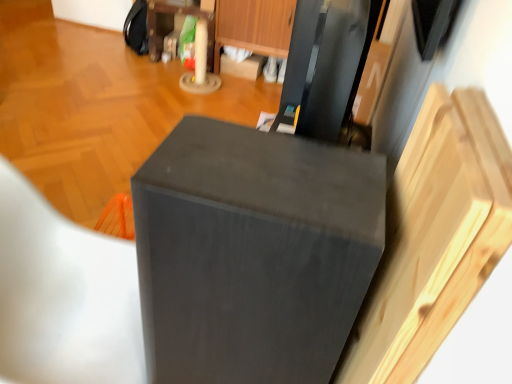
Question: Is matte wood dresser at upper center taller than matte black speaker at center?

Choices:
 (A) no
 (B) yes

Answer: (A)

Question: Is matte wood dresser at upper center behind matte black speaker at center?

Choices:
 (A) no
 (B) yes

Answer: (B)

Question: From the image's perspective, is matte wood dresser at upper center located beneath matte black speaker at center?

Choices:
 (A) yes
 (B) no

Answer: (B)

Question: Is matte wood dresser at upper center positioned before matte black speaker at center?

Choices:
 (A) yes
 (B) no

Answer: (B)

Question: Are matte wood dresser at upper center and matte black speaker at center far apart?

Choices:
 (A) no
 (B) yes

Answer: (B)

Question: Considering the relative positions of matte wood dresser at upper center and wooden drawer at upper center in the image provided, is matte wood dresser at upper center to the left or to the right of wooden drawer at upper center?

Choices:
 (A) left
 (B) right

Answer: (A)

Question: Looking at the image, does matte wood dresser at upper center seem bigger or smaller compared to wooden drawer at upper center?

Choices:
 (A) small
 (B) big

Answer: (A)

Question: In the image, is matte wood dresser at upper center positioned in front of or behind wooden drawer at upper center?

Choices:
 (A) behind
 (B) front

Answer: (A)

Question: From a real-world perspective, relative to wooden drawer at upper center, is matte wood dresser at upper center vertically above or below?

Choices:
 (A) below
 (B) above

Answer: (A)

Question: From the image's perspective, is matte wood dresser at upper center located above or below matte black folding chair at lower left?

Choices:
 (A) below
 (B) above

Answer: (B)

Question: Visually, is matte wood dresser at upper center positioned to the left or to the right of matte black folding chair at lower left?

Choices:
 (A) left
 (B) right

Answer: (A)

Question: Is matte wood dresser at upper center bigger or smaller than matte black folding chair at lower left?

Choices:
 (A) small
 (B) big

Answer: (A)

Question: Is matte wood dresser at upper center in front of or behind matte black folding chair at lower left in the image?

Choices:
 (A) behind
 (B) front

Answer: (A)

Question: Does point (25, 248) appear closer or farther from the camera than point (254, 33)?

Choices:
 (A) farther
 (B) closer

Answer: (B)

Question: Considering the positions of matte black folding chair at lower left and matte wood dresser at upper center in the image, is matte black folding chair at lower left wider or thinner than matte wood dresser at upper center?

Choices:
 (A) wide
 (B) thin

Answer: (A)